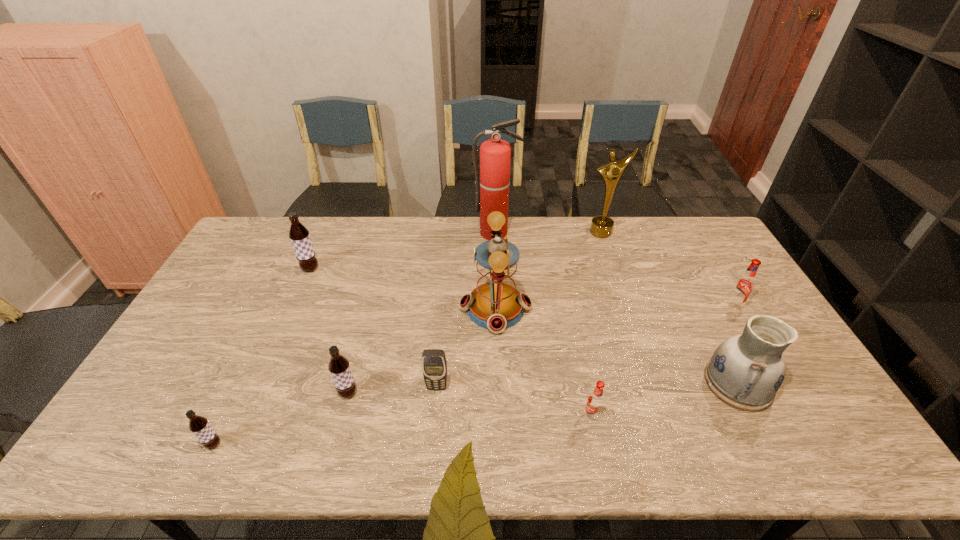
This screenshot has width=960, height=540. In order to click on vacant space located 0.240m on the front-facing side of the eighth shortest object in this screenshot , I will do (382, 308).

Find the location of a particular element. This screenshot has width=960, height=540. blank space located on the left of the eighth nearest object is located at coordinates (269, 269).

This screenshot has height=540, width=960. What are the coordinates of `free spot located 0.290m on the left of the pottery` in the screenshot? It's located at (596, 383).

You are a GUI agent. You are given a task and a screenshot of the screen. Output one action in this format:
    pyautogui.click(x=<x>, y=<y>)
    Task: Click on the free spot located on the left of the bigger red root beer
    
    Given the screenshot: What is the action you would take?
    pyautogui.click(x=598, y=305)

Locate an element on the screen. This screenshot has width=960, height=540. vacant area situated on the back of the third farthest root beer is located at coordinates (364, 333).

Where is `vacant space located on the front face of the fourth object from left to right`? Image resolution: width=960 pixels, height=540 pixels. vacant space located on the front face of the fourth object from left to right is located at coordinates (431, 458).

This screenshot has height=540, width=960. In order to click on vacant space located on the back of the nearest brown root beer in this screenshot , I will do click(239, 390).

Where is `vacant region located 0.160m on the left of the smaller red root beer`? The image size is (960, 540). vacant region located 0.160m on the left of the smaller red root beer is located at coordinates (519, 416).

Image resolution: width=960 pixels, height=540 pixels. What are the coordinates of `fire extinguisher located in the far edge section of the desktop` in the screenshot? It's located at (495, 154).

At what (x,y) coordinates should I click in order to perform the action: click on award situated at the far edge. Please return your answer as a coordinate pair (x, y). The height and width of the screenshot is (540, 960). Looking at the image, I should click on (601, 226).